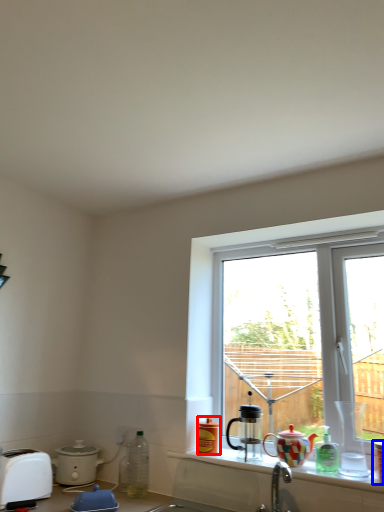
Question: Which object appears closest to the camera in this image, bottle (highlighted by a red box) or coffee cup (highlighted by a blue box)?

Choices:
 (A) bottle
 (B) coffee cup

Answer: (B)